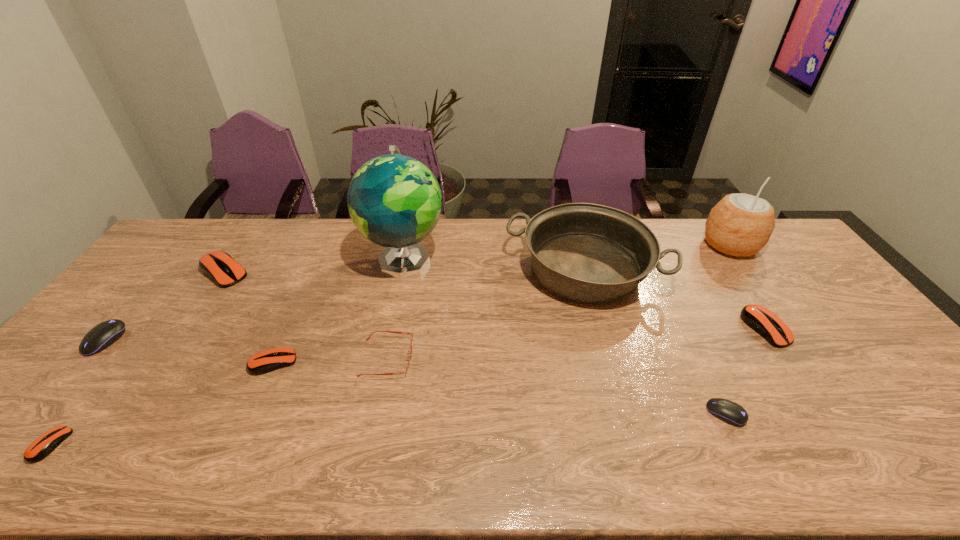
Where is `computer mouse that is at the far edge`? This screenshot has width=960, height=540. computer mouse that is at the far edge is located at coordinates (219, 266).

Where is `object at the near edge`? The width and height of the screenshot is (960, 540). object at the near edge is located at coordinates (44, 445).

I want to click on object present at the right edge, so (x=740, y=225).

Where is `object that is at the near left corner`? object that is at the near left corner is located at coordinates (44, 445).

Find the location of `object that is positioned at the far right corner`. object that is positioned at the far right corner is located at coordinates (740, 225).

Locate an element on the screen. The image size is (960, 540). vacant space at the far edge of the desktop is located at coordinates (515, 226).

Identify the location of blank area at the near edge. Image resolution: width=960 pixels, height=540 pixels. (259, 448).

The width and height of the screenshot is (960, 540). In the image, there is a desktop. In order to click on free space at the left edge in this screenshot , I will do `click(138, 295)`.

In the image, there is a desktop. At what (x,y) coordinates should I click in order to perform the action: click on vacant space at the right edge. Please return your answer as a coordinate pair (x, y). The image size is (960, 540). Looking at the image, I should click on (x=811, y=316).

You are a GUI agent. You are given a task and a screenshot of the screen. Output one action in this format:
    pyautogui.click(x=<x>, y=<y>)
    Task: Click on the free space that is in between the third biggest orange computer mouse and the coconut
    The image size is (960, 540).
    Given the screenshot: What is the action you would take?
    pyautogui.click(x=502, y=304)